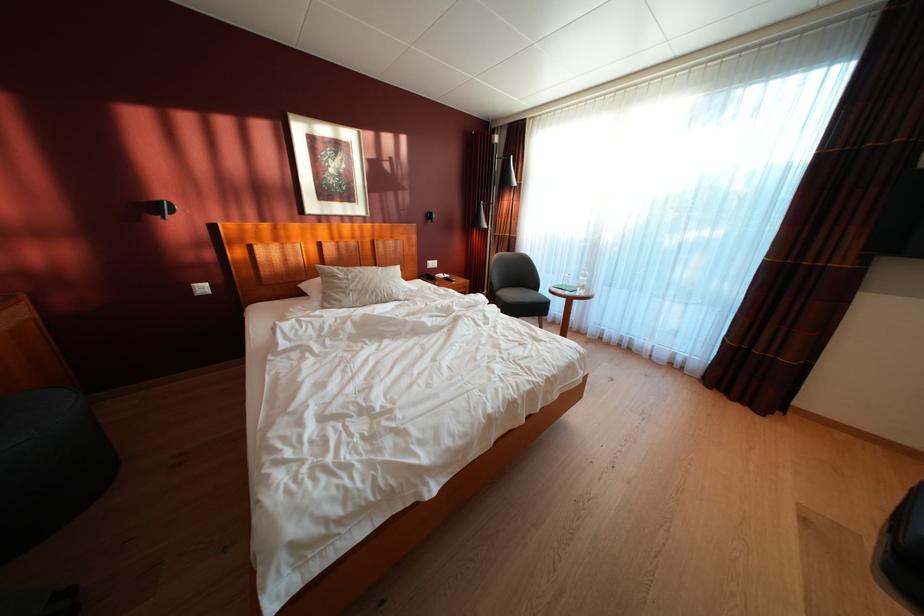
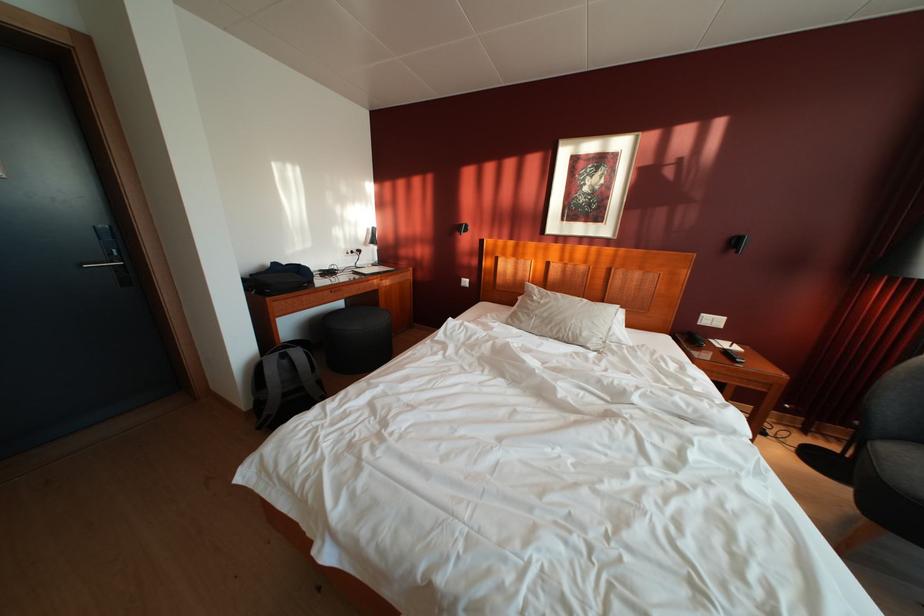
Locate, in the second image, the point that corresponds to [441,270] in the first image.

(721, 326)